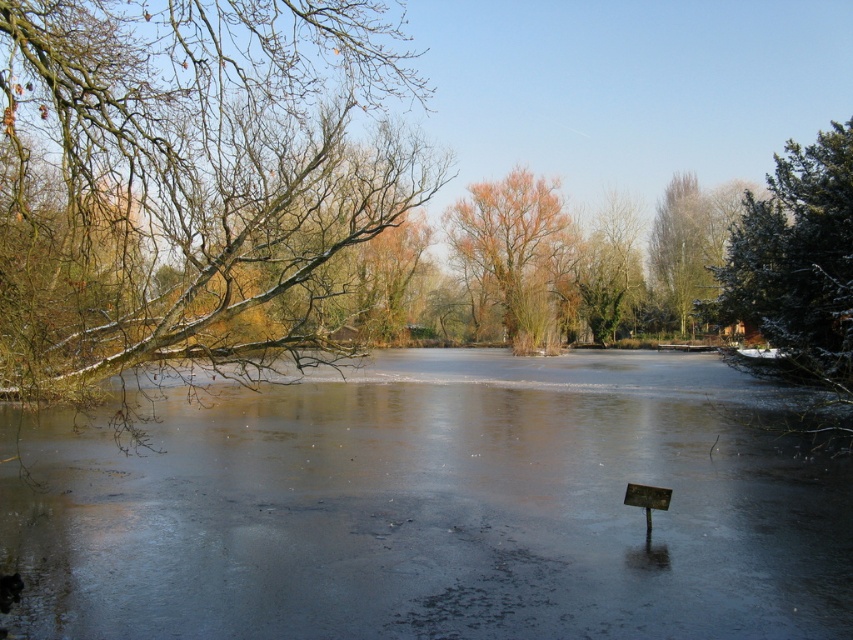
Question: Which point is closer to the camera?

Choices:
 (A) green leafy tree at upper center
 (B) green textured evergreen tree at right
 (C) orange-brown bark tree at center

Answer: (B)

Question: From the image, what is the correct spatial relationship of orange-brown bark tree at center in relation to green leafy tree at upper center?

Choices:
 (A) above
 (B) below

Answer: (B)

Question: Which object appears farthest from the camera in this image?

Choices:
 (A) green leafy tree at upper center
 (B) green textured evergreen tree at right

Answer: (A)

Question: Which of the following is the closest to the observer?

Choices:
 (A) (764, 369)
 (B) (677, 529)
 (C) (453, 218)

Answer: (B)

Question: Considering the relative positions of green textured evergreen tree at right and smooth brown tree at center in the image provided, where is green textured evergreen tree at right located with respect to smooth brown tree at center?

Choices:
 (A) below
 (B) above

Answer: (A)

Question: Does snow-covered branches at left have a lesser width compared to smooth brown tree at center?

Choices:
 (A) yes
 (B) no

Answer: (A)